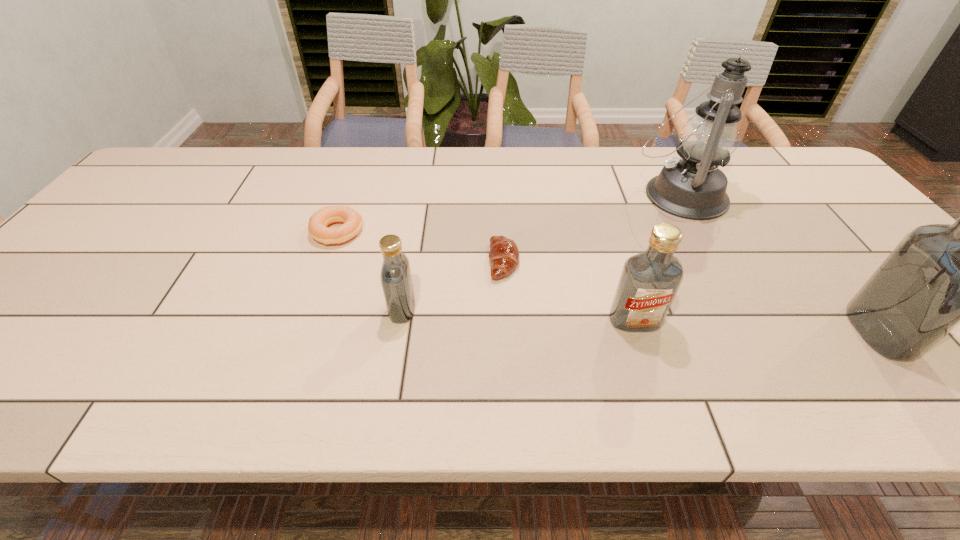
Identify the location of free space located 0.400m on the front-facing side of the shortest vodka. (210, 309).

You are a GUI agent. You are given a task and a screenshot of the screen. Output one action in this format:
    pyautogui.click(x=<x>, y=<y>)
    Task: Click on the free space located on the front-facing side of the shortest vodka
    Image resolution: width=960 pixels, height=540 pixels.
    Given the screenshot: What is the action you would take?
    pyautogui.click(x=358, y=309)

Locate an element on the screen. vacant point located on the front-facing side of the tallest vodka is located at coordinates (925, 332).

In order to click on free region located on the front of the fifth object from left to right in this screenshot , I will do `click(712, 255)`.

You are a GUI agent. You are given a task and a screenshot of the screen. Output one action in this format:
    pyautogui.click(x=<x>, y=<y>)
    Task: Click on the free space located 0.060m on the left of the fourth object from right to left
    This screenshot has height=540, width=960.
    Given the screenshot: What is the action you would take?
    pyautogui.click(x=465, y=261)

You are a GUI agent. You are given a task and a screenshot of the screen. Output one action in this format:
    pyautogui.click(x=<x>, y=<y>)
    Task: Click on the free space located 0.170m on the back of the bagel
    This screenshot has height=540, width=960.
    Given the screenshot: What is the action you would take?
    pyautogui.click(x=355, y=182)

Where is `object at the far edge`? object at the far edge is located at coordinates 693,187.

The image size is (960, 540). Find the location of `object located at the right edge`. object located at the right edge is located at coordinates (941, 275).

I want to click on object present at the near right corner, so click(941, 275).

Identify the location of free spot at the far edge of the desktop. The width and height of the screenshot is (960, 540). (379, 156).